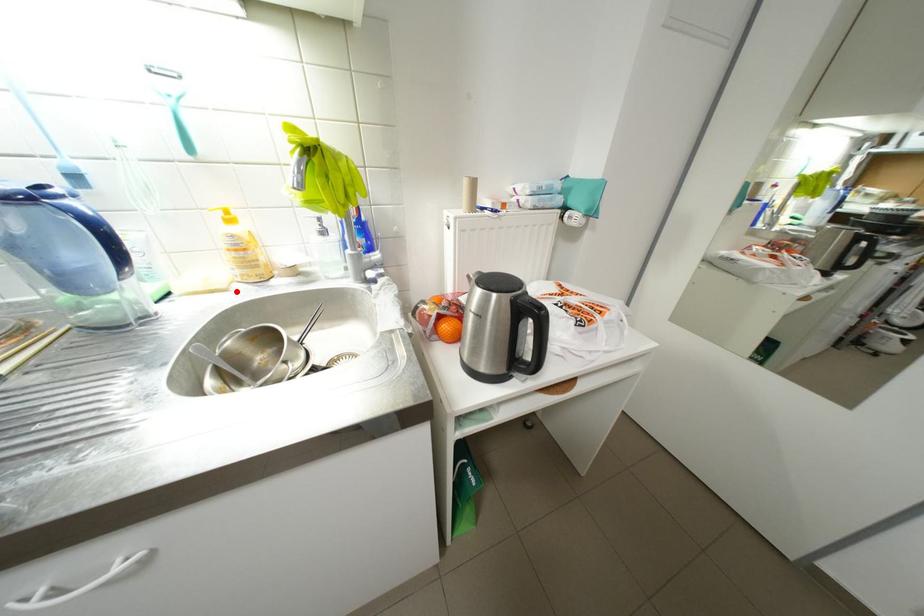
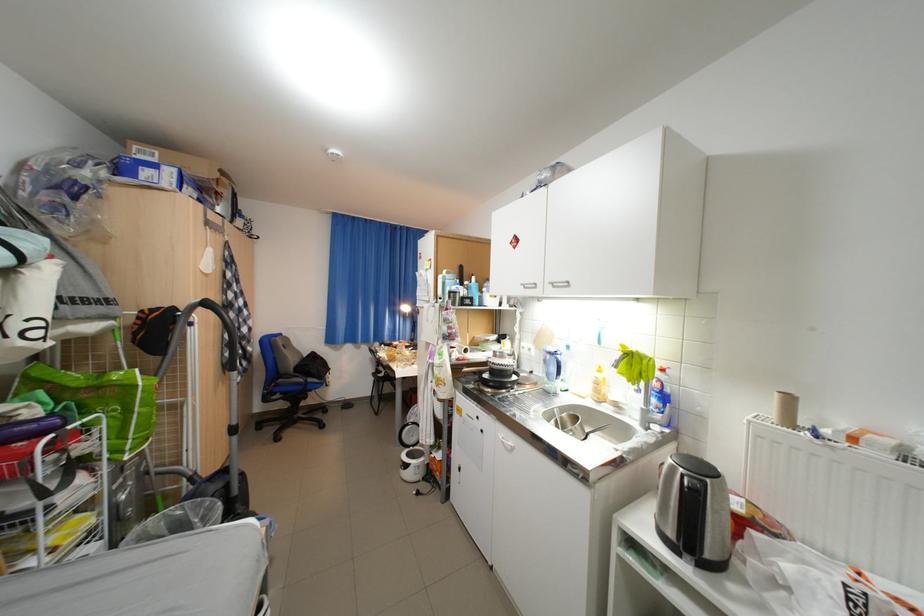
Find the pixel in the second image that matches the highlighted location in the first image.

(594, 399)